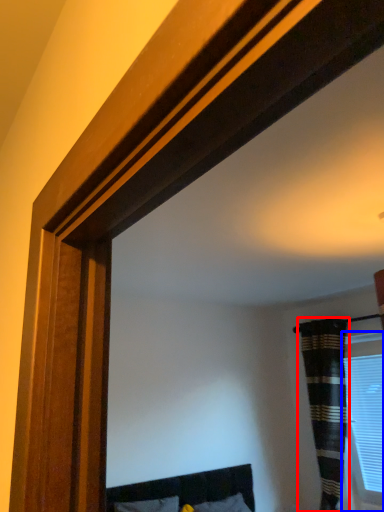
Question: Among these objects, which one is nearest to the camera, curtain (highlighted by a red box) or window (highlighted by a blue box)?

Choices:
 (A) curtain
 (B) window

Answer: (A)